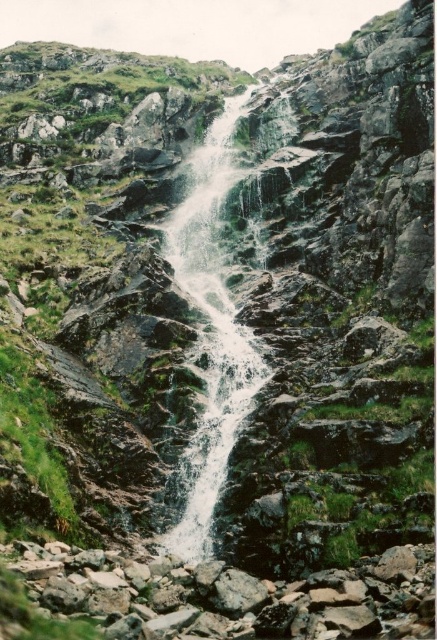
You are standing at the base of the waterfall and looking up at the cliff face. There are two points marked on the cliff wall, one at coordinates point [75,561] and another at point [217,264]. Which point is closer to your current position?

Point [75,561] is closer to the camera than point [217,264], so the point at coordinates point [75,561] is closer to your current position.

You are a hiker trying to cross the waterfall area. You see the rocky boulder at center and the white frothy water at center. Which object is smaller in size and safer to step on?

The rocky boulder at center is smaller than the white frothy water at center, so it is safer to step on the rocky boulder at center.

You are a hiker who wants to cross from the rocky boulder at center to the white frothy water at center. Given that your hiking boots have a maximum safe jump distance of 1.5 meters, can you safely make the jump?

The rocky boulder at center and white frothy water at center are 14.61 meters apart, which is much greater than the 1.5 meters maximum safe jump distance of your hiking boots. Therefore, you cannot safely make the jump.